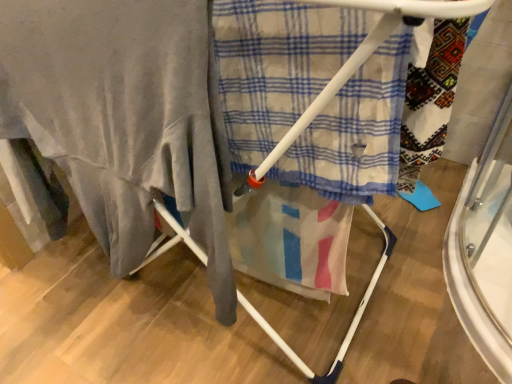
Question: Does white plastic drying rack at center appear on the right side of matte gray blanket at left?

Choices:
 (A) yes
 (B) no

Answer: (A)

Question: From a real-world perspective, is white plastic drying rack at center on matte gray blanket at left?

Choices:
 (A) yes
 (B) no

Answer: (B)

Question: Is white plastic drying rack at center next to matte gray blanket at left and touching it?

Choices:
 (A) yes
 (B) no

Answer: (B)

Question: From the image's perspective, does white plastic drying rack at center appear higher than matte gray blanket at left?

Choices:
 (A) yes
 (B) no

Answer: (A)

Question: Is white plastic drying rack at center to the left of matte gray blanket at left from the viewer's perspective?

Choices:
 (A) yes
 (B) no

Answer: (B)

Question: In terms of width, does plaid fabric at center look wider or thinner when compared to matte gray blanket at left?

Choices:
 (A) wide
 (B) thin

Answer: (B)

Question: Considering the positions of point (326, 139) and point (93, 178), is point (326, 139) closer or farther from the camera than point (93, 178)?

Choices:
 (A) closer
 (B) farther

Answer: (A)

Question: Is plaid fabric at center bigger or smaller than matte gray blanket at left?

Choices:
 (A) small
 (B) big

Answer: (A)

Question: From the image's perspective, relative to matte gray blanket at left, is plaid fabric at center above or below?

Choices:
 (A) below
 (B) above

Answer: (B)

Question: Considering the positions of matte gray blanket at left and white plastic drying rack at center in the image, is matte gray blanket at left bigger or smaller than white plastic drying rack at center?

Choices:
 (A) big
 (B) small

Answer: (B)

Question: Would you say matte gray blanket at left is inside or outside white plastic drying rack at center?

Choices:
 (A) outside
 (B) inside

Answer: (B)

Question: From the image's perspective, relative to white plastic drying rack at center, is matte gray blanket at left above or below?

Choices:
 (A) above
 (B) below

Answer: (B)

Question: From a real-world perspective, is matte gray blanket at left physically located above or below white plastic drying rack at center?

Choices:
 (A) below
 (B) above

Answer: (B)

Question: Considering the positions of white plastic drying rack at center and plaid fabric at center in the image, is white plastic drying rack at center wider or thinner than plaid fabric at center?

Choices:
 (A) thin
 (B) wide

Answer: (B)

Question: In the image, is white plastic drying rack at center positioned in front of or behind plaid fabric at center?

Choices:
 (A) behind
 (B) front

Answer: (B)